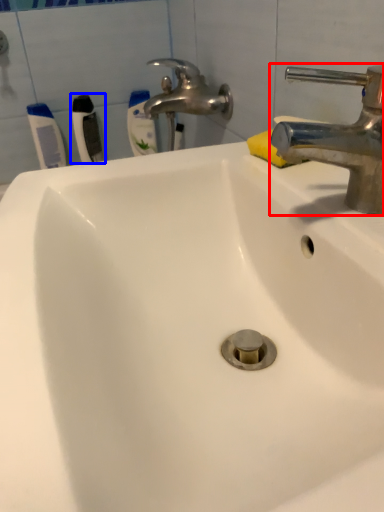
Question: Which object is further to the camera taking this photo, tap (highlighted by a red box) or toothbrush (highlighted by a blue box)?

Choices:
 (A) tap
 (B) toothbrush

Answer: (B)